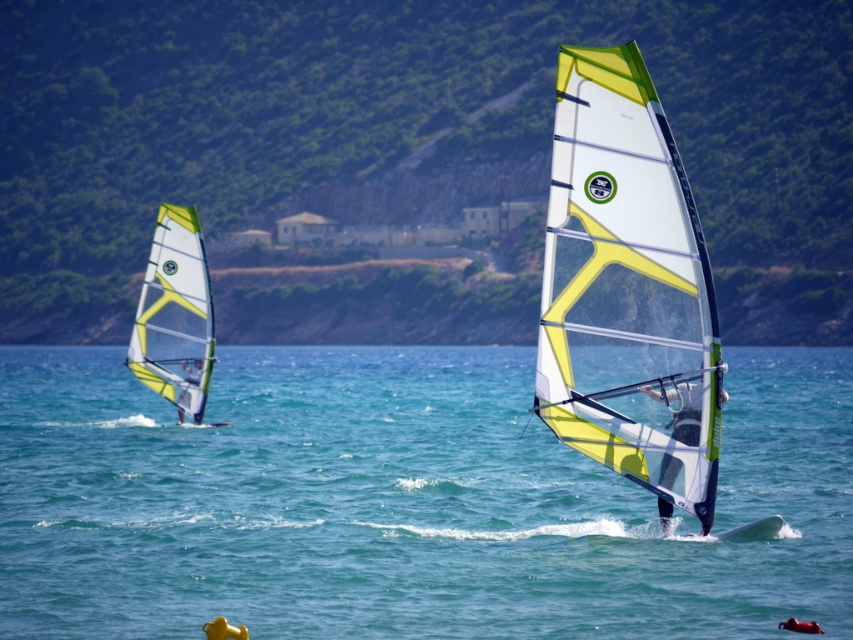
Question: From the image, what is the correct spatial relationship of transparent water at center in relation to matte white windsurfing board at left?

Choices:
 (A) left
 (B) right

Answer: (B)

Question: Can you confirm if transparent water at center is wider than white translucent sail at center?

Choices:
 (A) no
 (B) yes

Answer: (B)

Question: Among these objects, which one is farthest from the camera?

Choices:
 (A) transparent water at center
 (B) yellow-green translucent sail at left
 (C) green leafy hillside at upper center

Answer: (B)

Question: Which object appears farthest from the camera in this image?

Choices:
 (A) green leafy hillside at upper center
 (B) white matte sailboard at center
 (C) yellow-green translucent sail at left

Answer: (C)

Question: Is green leafy hillside at upper center thinner than matte white windsurfing board at left?

Choices:
 (A) no
 (B) yes

Answer: (A)

Question: Which object appears closest to the camera in this image?

Choices:
 (A) transparent water at center
 (B) matte white windsurfing board at left
 (C) white matte sailboard at center

Answer: (A)